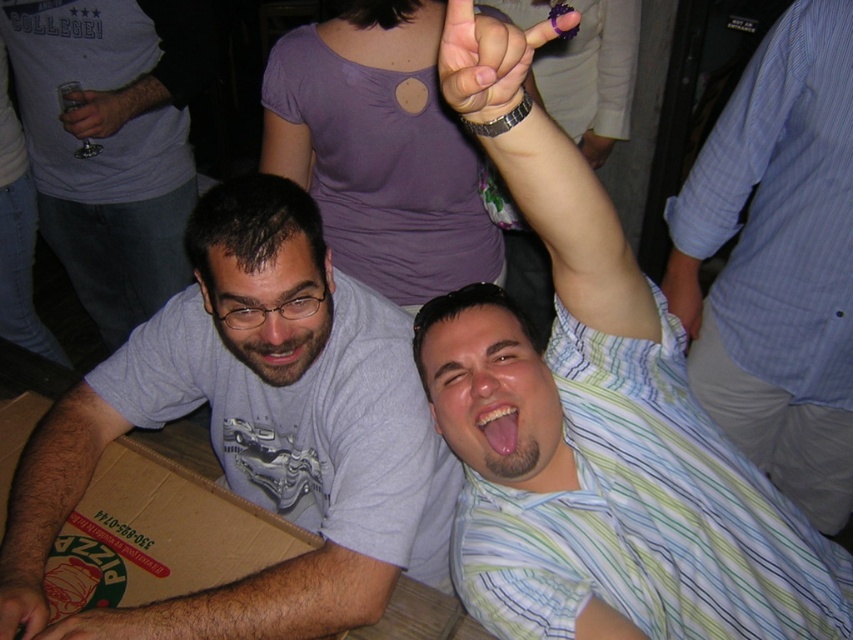
Question: Is blue striped shirt at upper right above black matte hand at lower left?

Choices:
 (A) no
 (B) yes

Answer: (B)

Question: Estimate the real-world distances between objects in this image. Which object is closer to the metallic silver cup at upper left?

Choices:
 (A) purple plastic ring at upper center
 (B) green striped shirt at upper right

Answer: (B)

Question: Is purple plastic ring at upper center below metallic silver cup at upper left?

Choices:
 (A) yes
 (B) no

Answer: (A)

Question: Can you confirm if black matte hand at lower left is positioned below hair at lower left?

Choices:
 (A) no
 (B) yes

Answer: (A)

Question: Among these points, which one is farthest from the camera?

Choices:
 (A) (450, 26)
 (B) (144, 100)
 (C) (618, 385)
 (D) (3, 586)

Answer: (B)

Question: Among these points, which one is nearest to the camera?

Choices:
 (A) (115, 384)
 (B) (724, 632)
 (C) (22, 609)
 (D) (80, 109)

Answer: (B)